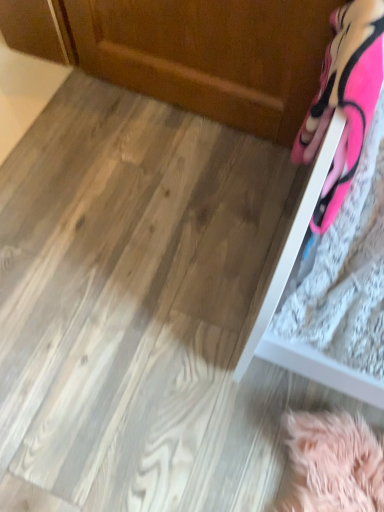
You are a GUI agent. You are given a task and a screenshot of the screen. Output one action in this format:
    pyautogui.click(x=<x>, y=<y>)
    Task: Click on the blank area beneath pink fabric bed at right (from a real-world perspective)
    
    Given the screenshot: What is the action you would take?
    pyautogui.click(x=278, y=223)